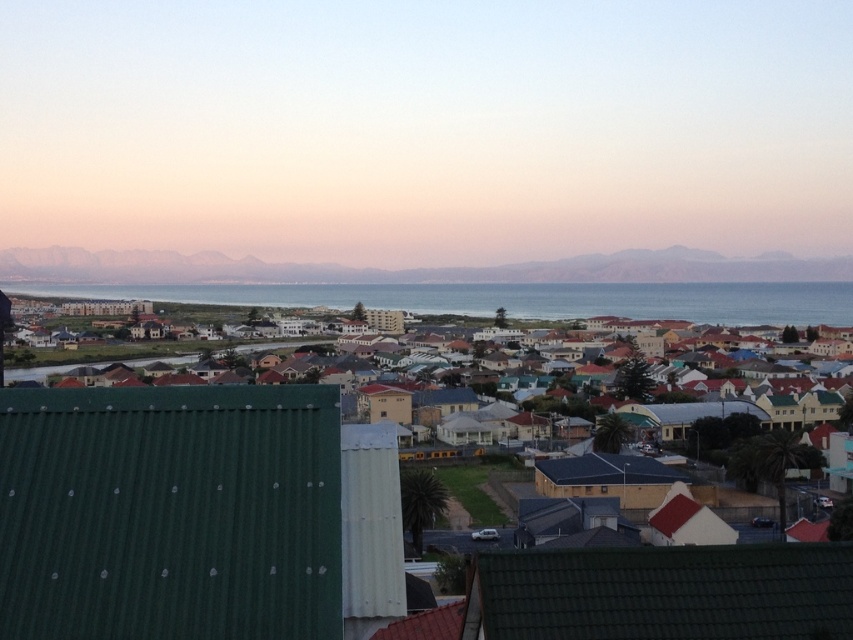
Question: Is green corrugated metal town at center positioned at the back of blue water at center?

Choices:
 (A) yes
 (B) no

Answer: (B)

Question: Which object is closer to the camera taking this photo?

Choices:
 (A) blue water at center
 (B) green corrugated metal town at center

Answer: (B)

Question: Can you confirm if green corrugated metal town at center is bigger than blue water at center?

Choices:
 (A) yes
 (B) no

Answer: (B)

Question: Which of the following is the closest to the observer?

Choices:
 (A) green corrugated metal town at center
 (B) blue water at center

Answer: (A)

Question: Is green corrugated metal town at center thinner than blue water at center?

Choices:
 (A) yes
 (B) no

Answer: (A)